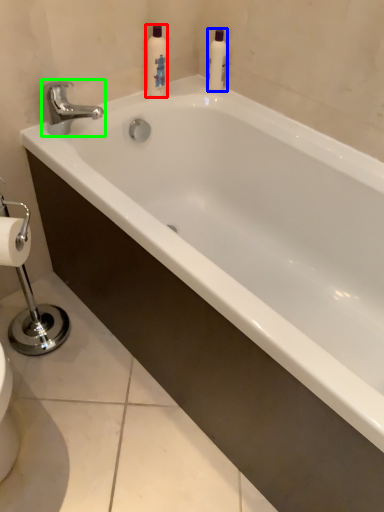
Question: Considering the real-world distances, which object is closest to cleaning product (highlighted by a red box)? cleaning product (highlighted by a blue box) or tap (highlighted by a green box).

Choices:
 (A) cleaning product
 (B) tap

Answer: (A)